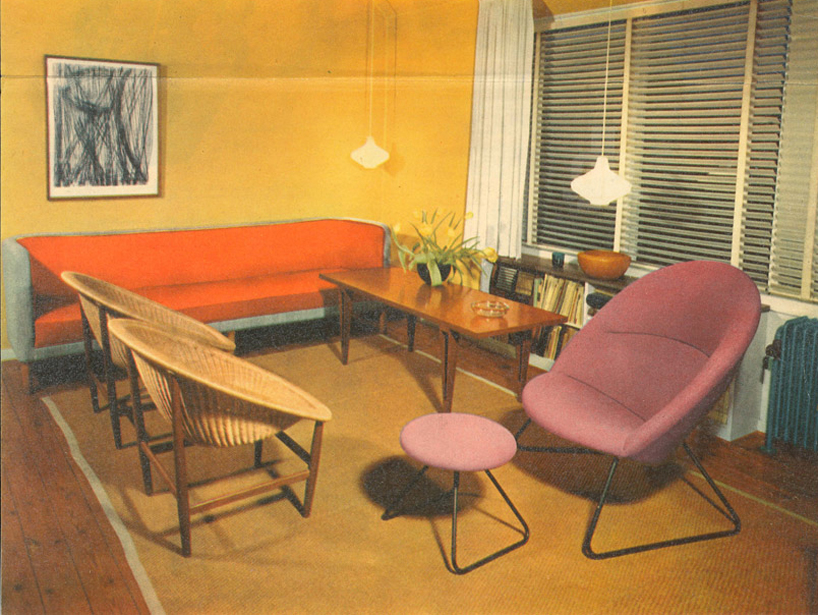
You are a GUI agent. You are given a task and a screenshot of the screen. Output one action in this format:
    pyautogui.click(x=<x>, y=<y>)
    Task: Click on the hanging light fixtures
    The height and width of the screenshot is (615, 818).
    Given the screenshot: What is the action you would take?
    [x=375, y=152], [x=591, y=184]